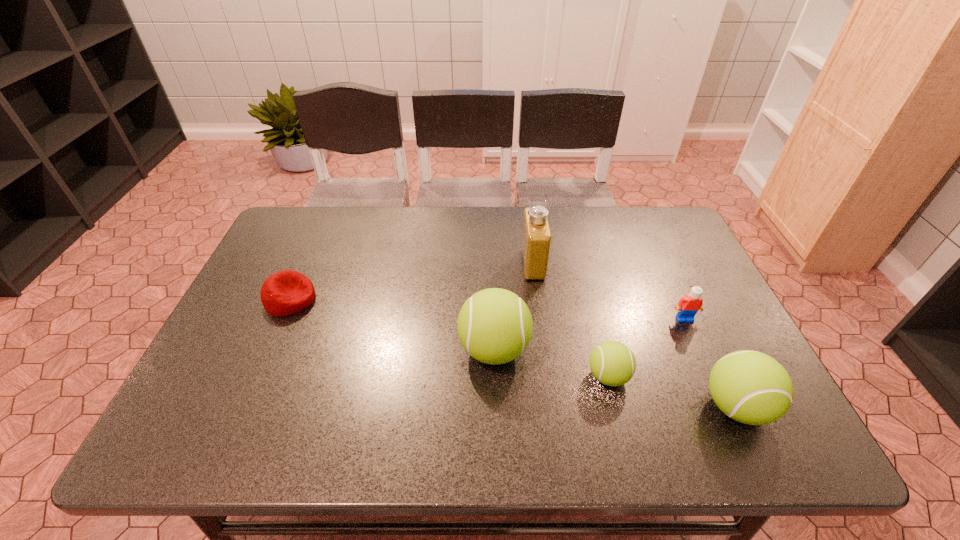
Identify the location of free region that satisfies the following two spatial constraints: 1. on the front-facing side of the third object from left to right; 2. on the right side of the second tennis ball from right to left. (548, 376).

Find the location of a particular element. The image size is (960, 540). vacant point that satisfies the following two spatial constraints: 1. on the front-facing side of the rightmost tennis ball; 2. on the left side of the farthest object is located at coordinates (552, 407).

I want to click on free spot that satisfies the following two spatial constraints: 1. on the seat area of the leftmost tennis ball; 2. on the left side of the beanbag, so click(269, 349).

The height and width of the screenshot is (540, 960). Find the location of `free spot that satisfies the following two spatial constraints: 1. on the front-facing side of the third object from left to right; 2. on the right side of the rightmost tennis ball`. free spot that satisfies the following two spatial constraints: 1. on the front-facing side of the third object from left to right; 2. on the right side of the rightmost tennis ball is located at coordinates (552, 407).

At what (x,y) coordinates should I click in order to perform the action: click on vacant space that satisfies the following two spatial constraints: 1. on the front-facing side of the farthest object; 2. on the back side of the third object from right to left. Please return your answer as a coordinate pair (x, y). Image resolution: width=960 pixels, height=540 pixels. Looking at the image, I should click on (548, 376).

This screenshot has height=540, width=960. I want to click on blank space that satisfies the following two spatial constraints: 1. on the front-facing side of the farthest object; 2. on the left side of the third tallest object, so click(x=552, y=407).

I want to click on free space in the image that satisfies the following two spatial constraints: 1. on the front-facing side of the rightmost tennis ball; 2. on the right side of the perfume, so point(552,407).

Find the location of `free location that satisfies the following two spatial constraints: 1. on the front-facing side of the rightmost tennis ball; 2. on the left side of the farthest object`. free location that satisfies the following two spatial constraints: 1. on the front-facing side of the rightmost tennis ball; 2. on the left side of the farthest object is located at coordinates (552, 407).